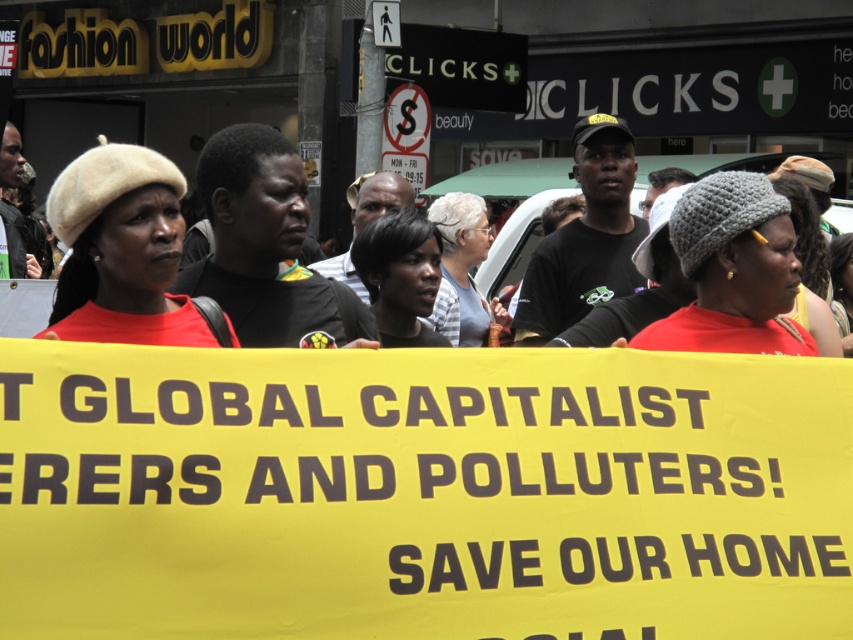
Question: Is beige felt beret at left closer to the viewer compared to red fabric crowd at center?

Choices:
 (A) no
 (B) yes

Answer: (B)

Question: Which of the following is the farthest from the observer?

Choices:
 (A) (398, 292)
 (B) (16, 328)

Answer: (B)

Question: Which point is closer to the camera?

Choices:
 (A) (751, 333)
 (B) (834, 305)
 (C) (1, 323)
 (D) (437, 285)

Answer: (A)

Question: Which of these objects is positioned farthest from the light gray knit hat at center?

Choices:
 (A) dark brown hair at center
 (B) gray knitted hat at upper center
 (C) beige felt beret at left
 (D) gray knitted hat at center

Answer: (C)

Question: Does beige felt beret at left appear on the left side of light gray knit hat at center?

Choices:
 (A) yes
 (B) no

Answer: (A)

Question: Is gray knitted hat at center closer to the viewer compared to light gray knit hat at center?

Choices:
 (A) no
 (B) yes

Answer: (B)